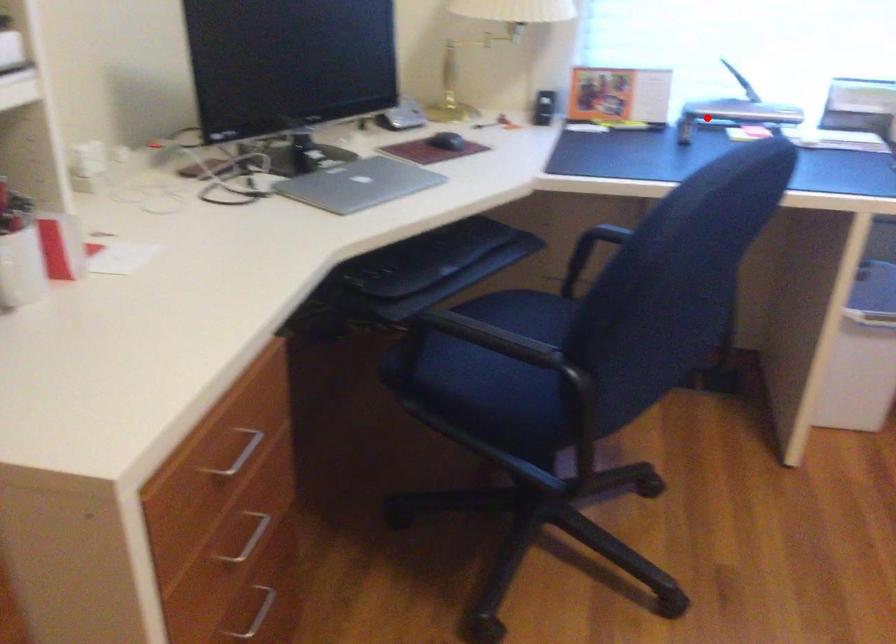
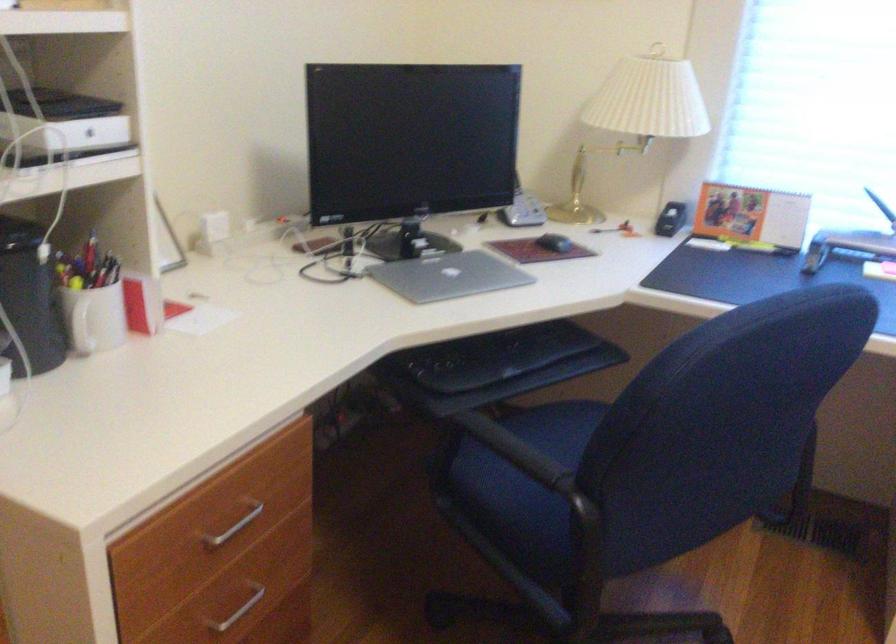
Where in the second image is the point corresponding to the highlighted location from the first image?

(847, 245)